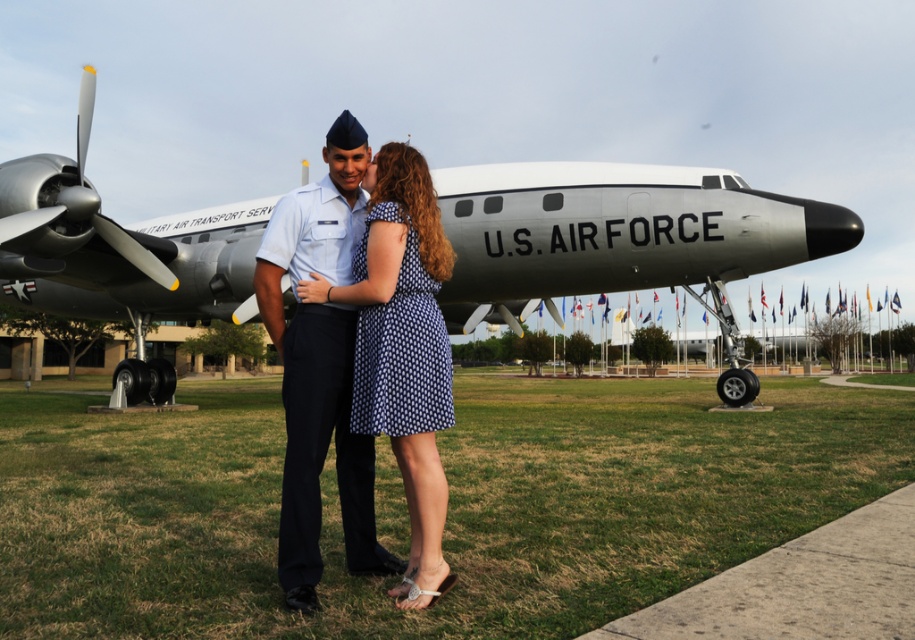
Question: Where is silver metallic airplane at center located in relation to silver metallic propeller at upper left in the image?

Choices:
 (A) right
 (B) left

Answer: (A)

Question: Is light blue uniform at center positioned at the back of silver metallic propeller at upper left?

Choices:
 (A) no
 (B) yes

Answer: (A)

Question: Can you confirm if silver metallic airplane at center is positioned below light blue uniform at center?

Choices:
 (A) no
 (B) yes

Answer: (A)

Question: Which of the following is the closest to the observer?

Choices:
 (A) silver metallic airplane at center
 (B) light blue uniform at center

Answer: (B)

Question: Which point is farther to the camera?

Choices:
 (A) (817, 236)
 (B) (92, 115)
 (C) (330, 186)

Answer: (A)

Question: Estimate the real-world distances between objects in this image. Which object is closer to the light blue uniform at center?

Choices:
 (A) silver metallic airplane at center
 (B) silver metallic propeller at upper left

Answer: (A)